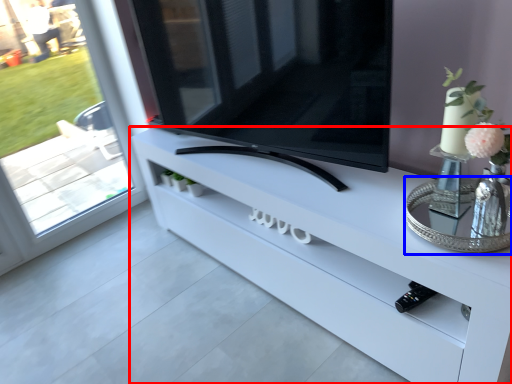
Question: Which object is closer to the camera taking this photo, furniture (highlighted by a red box) or glass table (highlighted by a blue box)?

Choices:
 (A) furniture
 (B) glass table

Answer: (A)